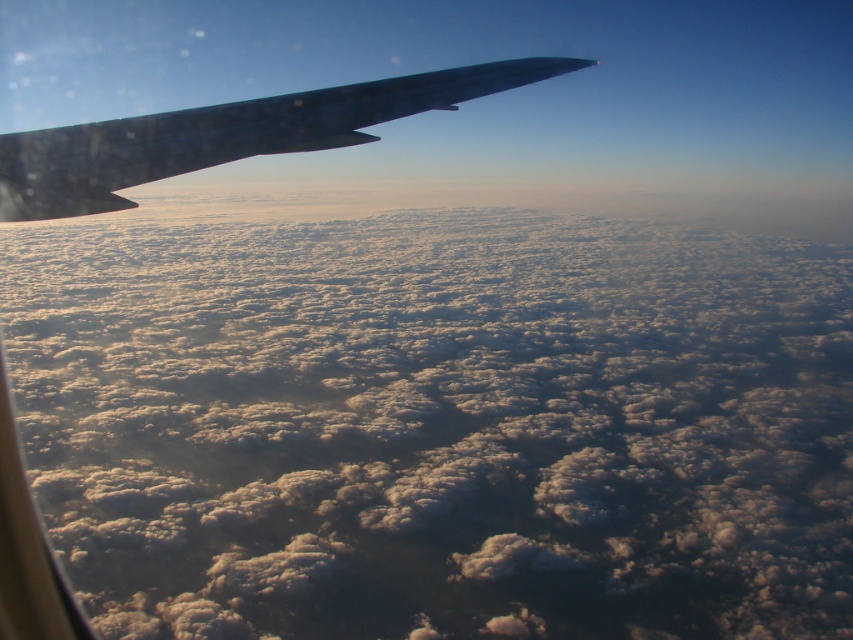
Question: Can you confirm if white fluffy cloud at upper center is positioned above glossy metallic wing at upper left?

Choices:
 (A) yes
 (B) no

Answer: (B)

Question: Which point is farther from the camera taking this photo?

Choices:
 (A) (161, 628)
 (B) (84, 168)

Answer: (A)

Question: Which point is closer to the camera?

Choices:
 (A) (85, 147)
 (B) (347, 621)

Answer: (A)

Question: Is white fluffy cloud at upper center to the right of glossy metallic wing at upper left from the viewer's perspective?

Choices:
 (A) yes
 (B) no

Answer: (A)

Question: Does white fluffy cloud at upper center appear on the right side of glossy metallic wing at upper left?

Choices:
 (A) yes
 (B) no

Answer: (A)

Question: Which point appears farthest from the camera in this image?

Choices:
 (A) (502, 84)
 (B) (653, 490)

Answer: (B)